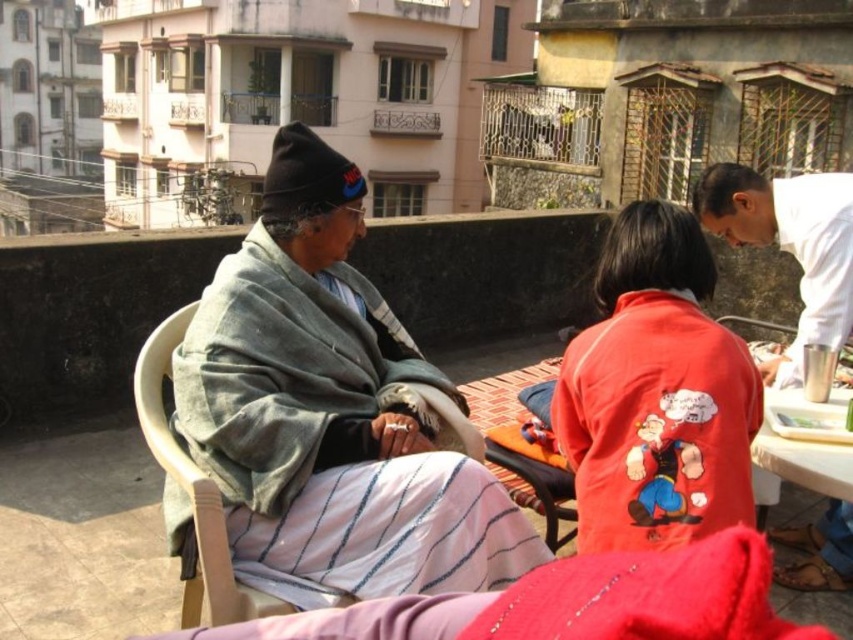
Question: Is gray woolen shawl at left above wooden chair at center?

Choices:
 (A) no
 (B) yes

Answer: (B)

Question: Which object appears farthest from the camera in this image?

Choices:
 (A) white fabric shirt at right
 (B) wooden chair at center
 (C) gray woolen shawl at left
 (D) red matte jacket at center

Answer: (A)

Question: Which of the following is the closest to the observer?

Choices:
 (A) (851, 508)
 (B) (183, 483)
 (C) (302, 262)

Answer: (B)

Question: Is gray woolen shawl at left wider than white fabric shirt at right?

Choices:
 (A) yes
 (B) no

Answer: (A)

Question: Can you confirm if gray woolen shawl at left is positioned to the left of red matte jacket at center?

Choices:
 (A) yes
 (B) no

Answer: (A)

Question: Estimate the real-world distances between objects in this image. Which object is farther from the red matte jacket at center?

Choices:
 (A) gray woolen shawl at left
 (B) white fabric shirt at right

Answer: (A)